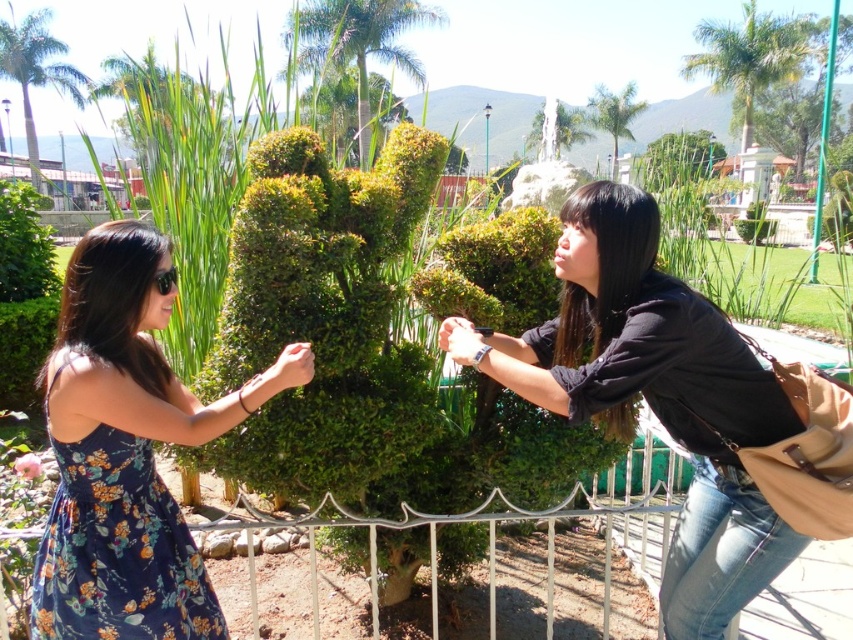
Question: Does black matte shirt at center appear on the left side of floral dress at left?

Choices:
 (A) yes
 (B) no

Answer: (B)

Question: Which object is the farthest from the floral dress at left?

Choices:
 (A) pink matte flower at lower left
 (B) floral print fabric dress at lower left
 (C) black matte shirt at center
 (D) green leafy bush at left

Answer: (D)

Question: Which point is farther to the camera?

Choices:
 (A) black matte shirt at center
 (B) green leafy bush at left

Answer: (B)

Question: Is floral dress at left to the left of pink matte flower at lower left from the viewer's perspective?

Choices:
 (A) yes
 (B) no

Answer: (B)

Question: Does black matte shirt at center have a lesser width compared to green leafy bush at left?

Choices:
 (A) yes
 (B) no

Answer: (B)

Question: Which of the following is the farthest from the observer?

Choices:
 (A) floral dress at left
 (B) pink matte flower at lower left
 (C) black matte shirt at center

Answer: (B)